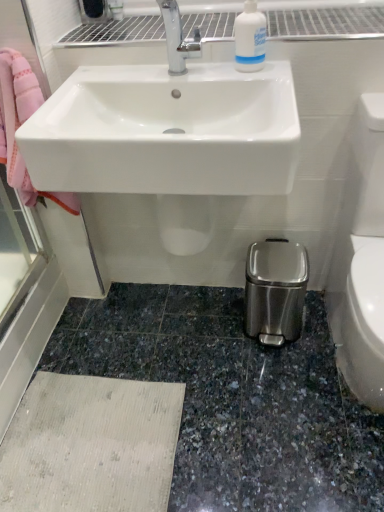
Question: Visually, is white plastic bottle at upper center positioned to the left or to the right of white glossy sink at upper center?

Choices:
 (A) right
 (B) left

Answer: (A)

Question: Considering the positions of white plastic bottle at upper center and white glossy sink at upper center in the image, is white plastic bottle at upper center bigger or smaller than white glossy sink at upper center?

Choices:
 (A) big
 (B) small

Answer: (B)

Question: Which object is the farthest from the white glossy sink at upper center?

Choices:
 (A) white plastic bottle at upper center
 (B) white glossy toilet bowl at lower right

Answer: (B)

Question: Which object is the closest to the white glossy toilet bowl at lower right?

Choices:
 (A) white plastic bottle at upper center
 (B) white glossy sink at upper center

Answer: (B)